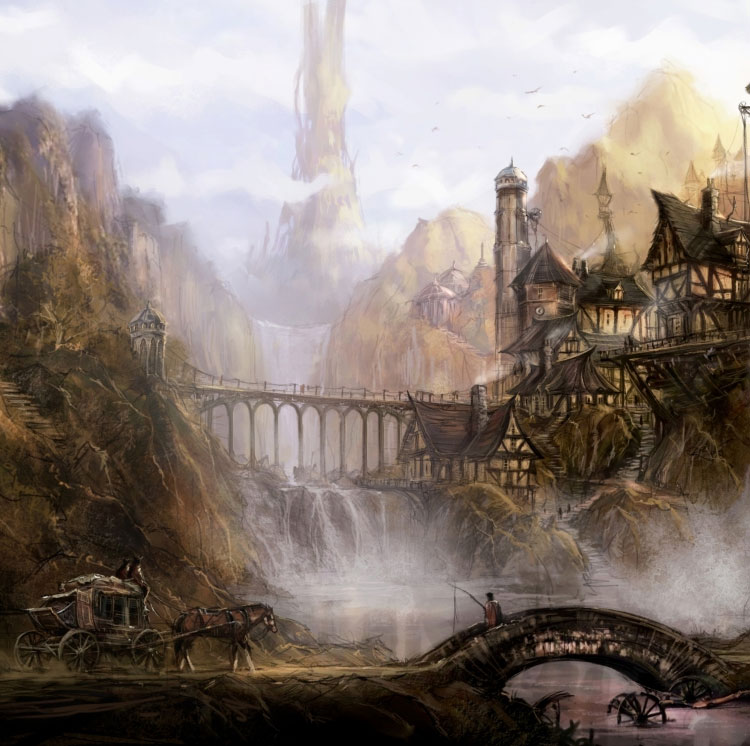
This screenshot has width=750, height=746. In order to click on painting in this screenshot , I will do click(298, 260).